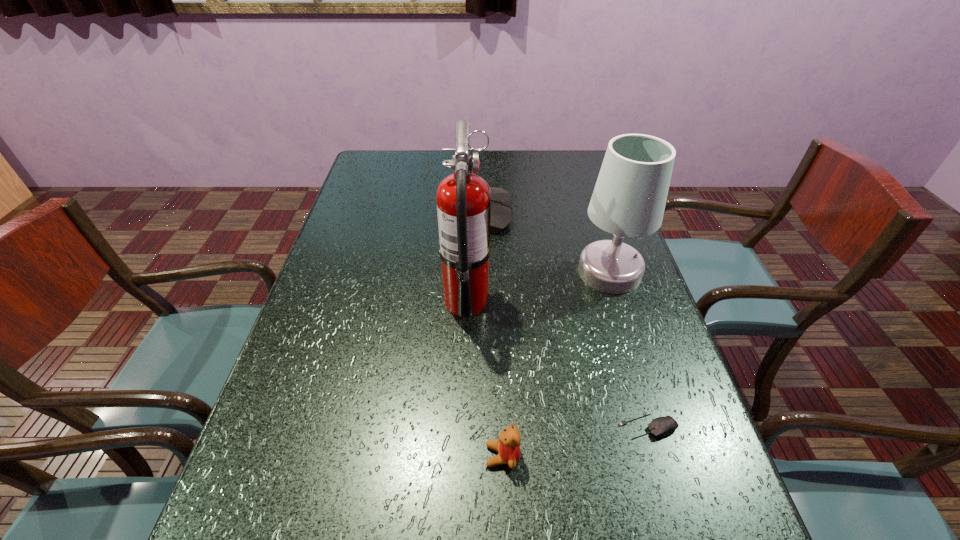
Identify the location of the tallest object. Image resolution: width=960 pixels, height=540 pixels. (463, 199).

Find the location of a particular element. lampshade is located at coordinates pyautogui.click(x=629, y=198).

Identify the location of router. This screenshot has width=960, height=540. (501, 216).

Where is `the farthest object`? The image size is (960, 540). the farthest object is located at coordinates (501, 216).

Where is `the second shortest object`? The height and width of the screenshot is (540, 960). the second shortest object is located at coordinates (x=508, y=446).

Where is `the shortest object`? The image size is (960, 540). the shortest object is located at coordinates (662, 426).

Locate an element on the screen. The image size is (960, 540). vacant region located 0.180m on the nozzle side of the fire extinguisher is located at coordinates (563, 301).

Identify the location of free space located 0.350m on the base of the lampshade. (658, 424).

Find the location of a particular element. vacant space situated on the back of the router is located at coordinates (402, 213).

Find the location of a particular element. vacant region located on the back of the router is located at coordinates (386, 213).